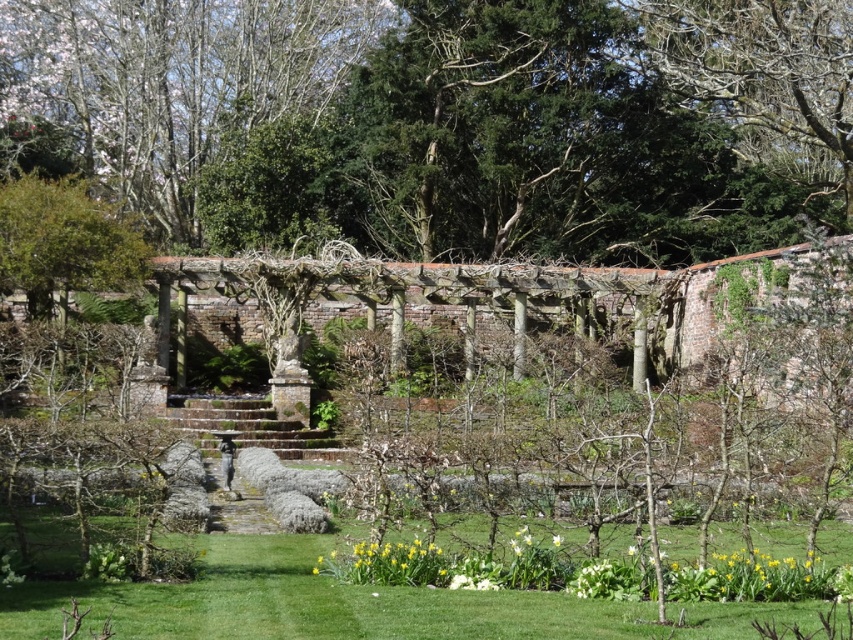
Is point (416, 566) positioned before point (560, 536)?

Yes.

Which is below, yellow matte daffodil at lower center or white matte flower at center?

Positioned lower is yellow matte daffodil at lower center.

Who is more forward, (407, 580) or (558, 545)?

Positioned in front is point (407, 580).

In order to click on yellow matte daffodil at lower center in this screenshot , I will do `click(396, 563)`.

Who is positioned more to the left, smooth bark tree at upper left or yellow matte daffodil at lower center?

smooth bark tree at upper left is more to the left.

Does point (33, 58) lie behind point (434, 568)?

That is True.

The image size is (853, 640). I want to click on smooth bark tree at upper left, so click(x=175, y=83).

In the scene shown: Measure the distance between green grass at center and yellow matte daffodil at lower center.

green grass at center and yellow matte daffodil at lower center are 1.78 meters apart from each other.

Can you confirm if green grass at center is thinner than yellow matte daffodil at lower center?

No.

Who is more distant from viewer, (x=303, y=563) or (x=440, y=557)?

The point (x=303, y=563) is more distant.

The height and width of the screenshot is (640, 853). Identify the location of green grass at center. (309, 602).